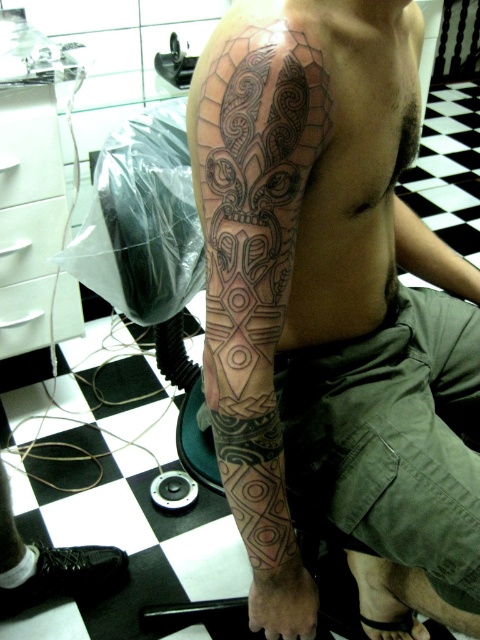
Does black ink tattoo at upper arm have a greater width compared to black ink tattoo at lower right?

Yes, black ink tattoo at upper arm is wider than black ink tattoo at lower right.

Is black ink tattoo at upper arm taller than black ink tattoo at lower right?

Indeed, black ink tattoo at upper arm has a greater height compared to black ink tattoo at lower right.

At what (x,y) coordinates should I click in order to perform the action: click on black ink tattoo at upper arm. Please return your answer as a coordinate pair (x, y). Looking at the image, I should click on (328, 308).

Is black ink tattoo at upper center shorter than black ink tattoo at lower right?

In fact, black ink tattoo at upper center may be taller than black ink tattoo at lower right.

Which is more to the right, black ink tattoo at upper center or black ink tattoo at lower right?

From the viewer's perspective, black ink tattoo at lower right appears more on the right side.

This screenshot has height=640, width=480. I want to click on black ink tattoo at upper center, so click(255, 278).

Locate an element on the screen. black ink tattoo at upper center is located at coordinates (255, 278).

Is black ink tattoo at upper arm further to camera compared to black ink tattoo at upper center?

Yes.

Does black ink tattoo at upper arm have a larger size compared to black ink tattoo at upper center?

Yes, black ink tattoo at upper arm is bigger than black ink tattoo at upper center.

Between point (302, 637) and point (262, 307), which one is positioned behind?

The point (302, 637) is behind.

I want to click on black ink tattoo at upper arm, so click(328, 308).